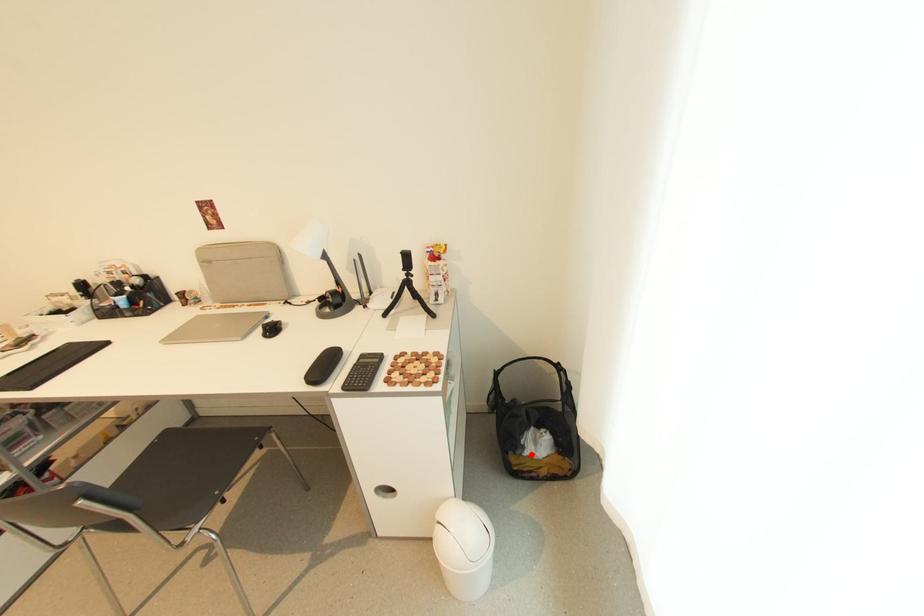
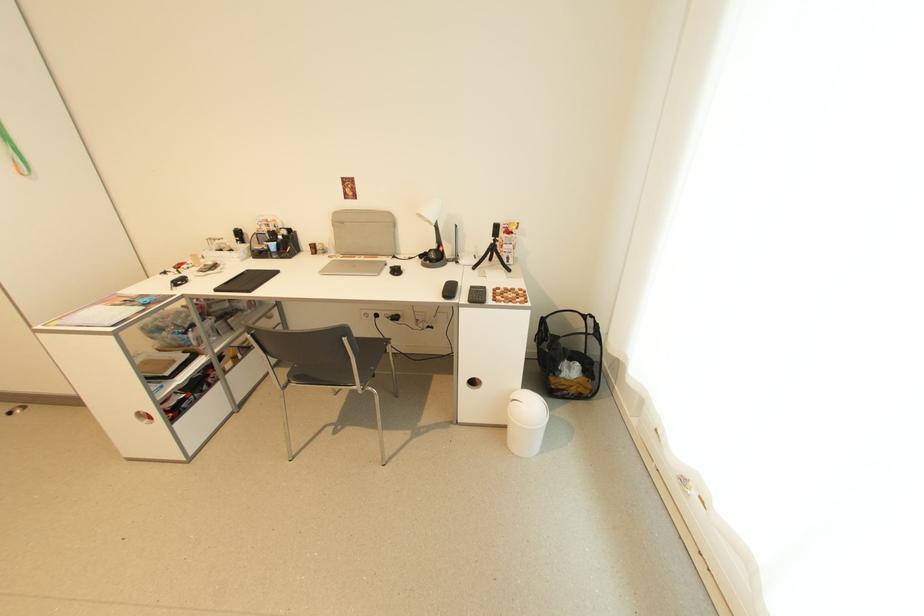
In the second image, find the point that corresponds to the highlighted location in the first image.

(566, 377)